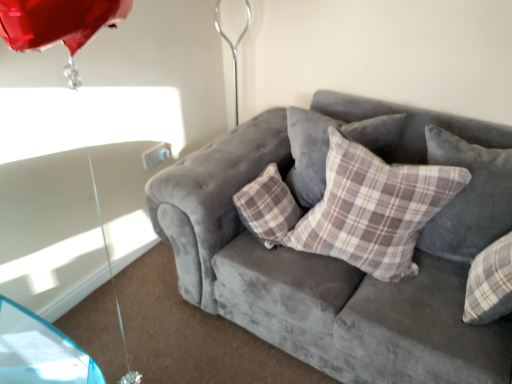
Question: From the image's perspective, is plaid fabric pillow at center, which is the 3th pillow in left-to-right order, above or below plaid fabric pillow at center, acting as the 1th pillow starting from the left?

Choices:
 (A) below
 (B) above

Answer: (A)

Question: Looking at the image, does plaid fabric pillow at center, the first pillow from the right, seem bigger or smaller compared to plaid fabric pillow at center, acting as the 1th pillow starting from the left?

Choices:
 (A) big
 (B) small

Answer: (B)

Question: Which of these objects is positioned closest to the velvet gray couch at center?

Choices:
 (A) plaid fabric pillow at center, the first pillow from the right
 (B) plaid fabric pillow at center, which appears as the second pillow when viewed from the right
 (C) plaid fabric pillow at center, acting as the third pillow starting from the right

Answer: (B)

Question: Based on their relative distances, which object is nearer to the velvet gray couch at center?

Choices:
 (A) plaid fabric pillow at center, acting as the 1th pillow starting from the left
 (B) plaid fabric pillow at center, arranged as the second pillow when viewed from the left
 (C) plaid fabric pillow at center, the first pillow from the right

Answer: (B)